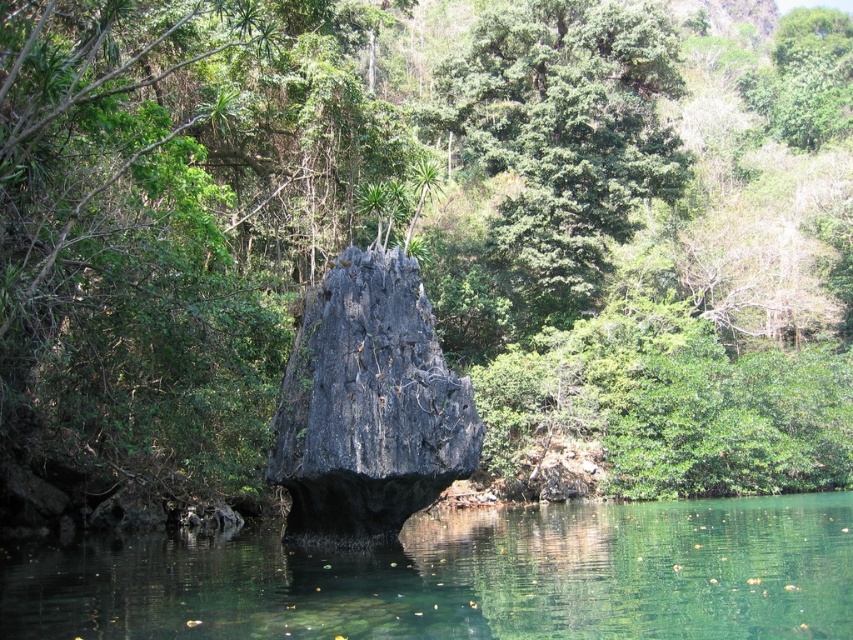
From the picture: Does green translucent water at center lie in front of green leafy tree at upper center?

Yes, green translucent water at center is closer to the viewer.

Describe the element at coordinates (468, 579) in the screenshot. This screenshot has width=853, height=640. I see `green translucent water at center` at that location.

Identify the location of green translucent water at center. The height and width of the screenshot is (640, 853). (468, 579).

This screenshot has width=853, height=640. What are the coordinates of `green translucent water at center` in the screenshot? It's located at (468, 579).

Which is above, green leafy tree at upper center or dark gray stone at center?

green leafy tree at upper center

Is green leafy tree at upper center to the right of dark gray stone at center from the viewer's perspective?

Indeed, green leafy tree at upper center is positioned on the right side of dark gray stone at center.

Image resolution: width=853 pixels, height=640 pixels. Find the location of `green leafy tree at upper center`. green leafy tree at upper center is located at coordinates (567, 134).

Can you confirm if green translucent water at center is taller than dark gray stone at center?

Correct, green translucent water at center is much taller as dark gray stone at center.

Is green translucent water at center closer to the viewer compared to dark gray stone at center?

Yes, green translucent water at center is closer to the viewer.

Is point (753, 611) positioned before point (344, 316)?

Yes, point (753, 611) is closer to viewer.

At what (x,y) coordinates should I click in order to perform the action: click on green translucent water at center. Please return your answer as a coordinate pair (x, y). Looking at the image, I should click on (468, 579).